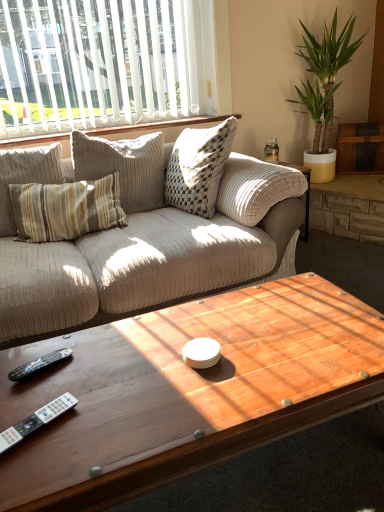
At what (x,y) coordinates should I click in order to perform the action: click on vacant area on the back side of white plastic remote at lower left. Please return your answer as a coordinate pair (x, y). Image resolution: width=384 pixels, height=512 pixels. Looking at the image, I should click on (52, 385).